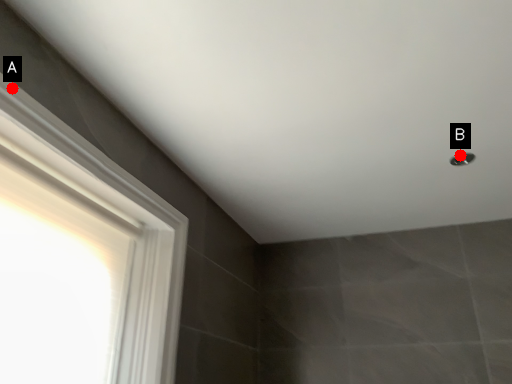
Question: Two points are circled on the image, labeled by A and B beside each circle. Among these points, which one is nearest to the camera?

Choices:
 (A) A is closer
 (B) B is closer

Answer: (A)